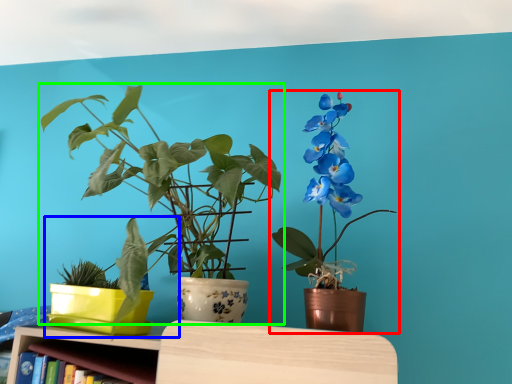
Question: Which object is the farthest from houseplant (highlighted by a red box)? Choose among these: houseplant (highlighted by a blue box) or houseplant (highlighted by a green box).

Choices:
 (A) houseplant
 (B) houseplant

Answer: (A)